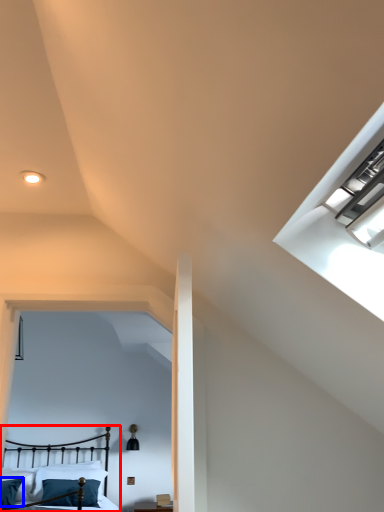
Question: Which object is further to the camera taking this photo, bed (highlighted by a red box) or pillow (highlighted by a blue box)?

Choices:
 (A) bed
 (B) pillow

Answer: (B)